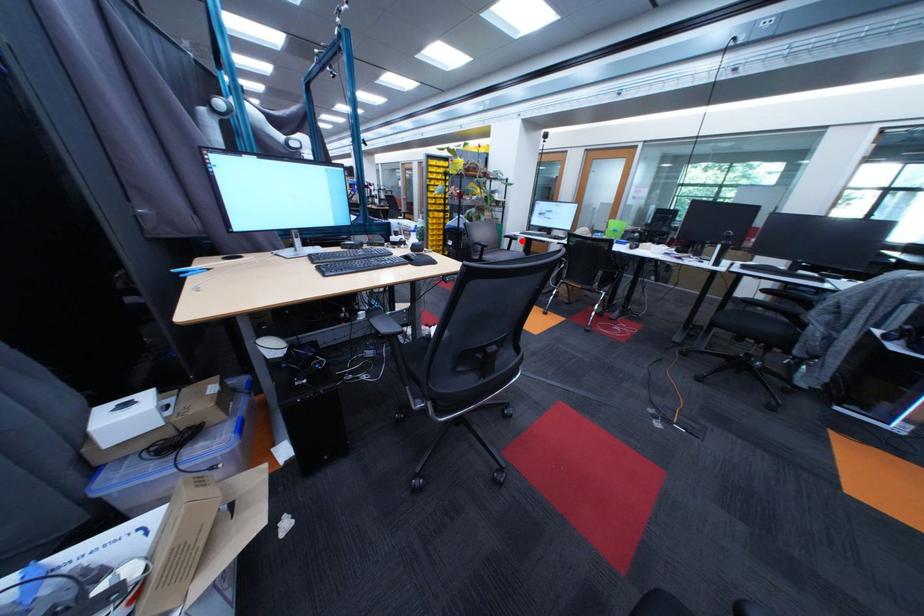
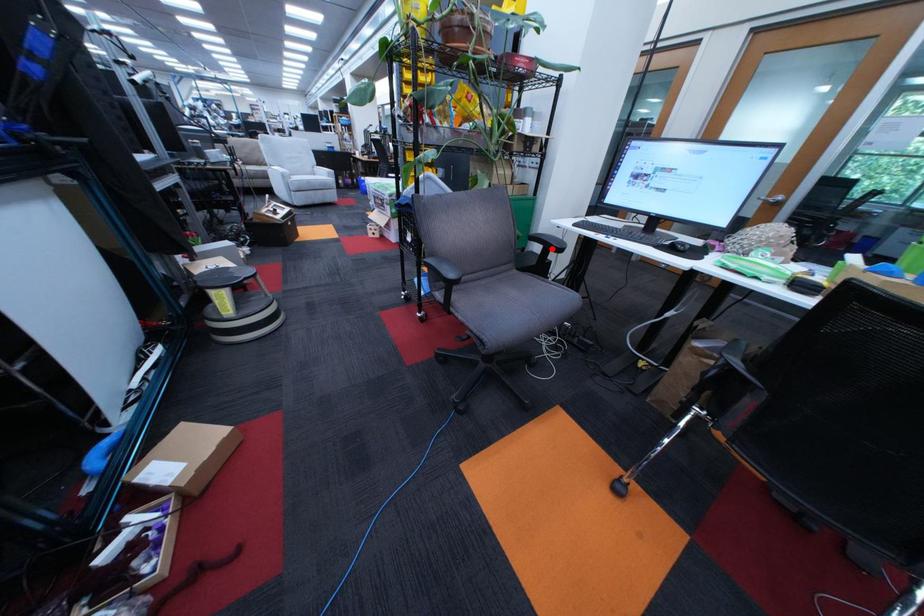
I am providing you with two images of the same scene from different viewpoints. A red point is marked on the first image and another point is marked on the second image. Are the points marked in image1 and image2 representing the same 3D position?

Yes